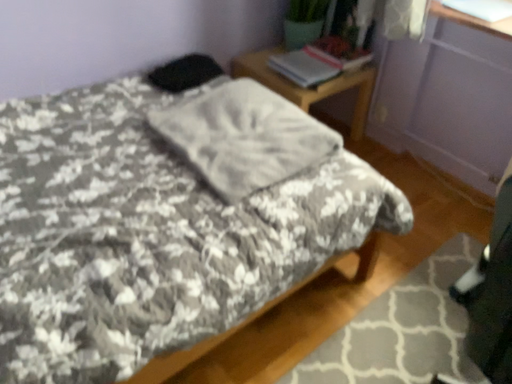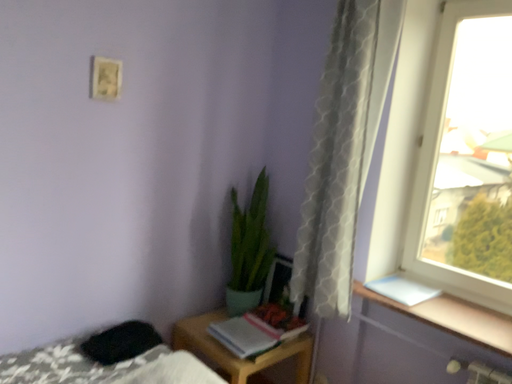
Question: How did the camera likely rotate when shooting the video?

Choices:
 (A) rotated right
 (B) rotated left

Answer: (A)